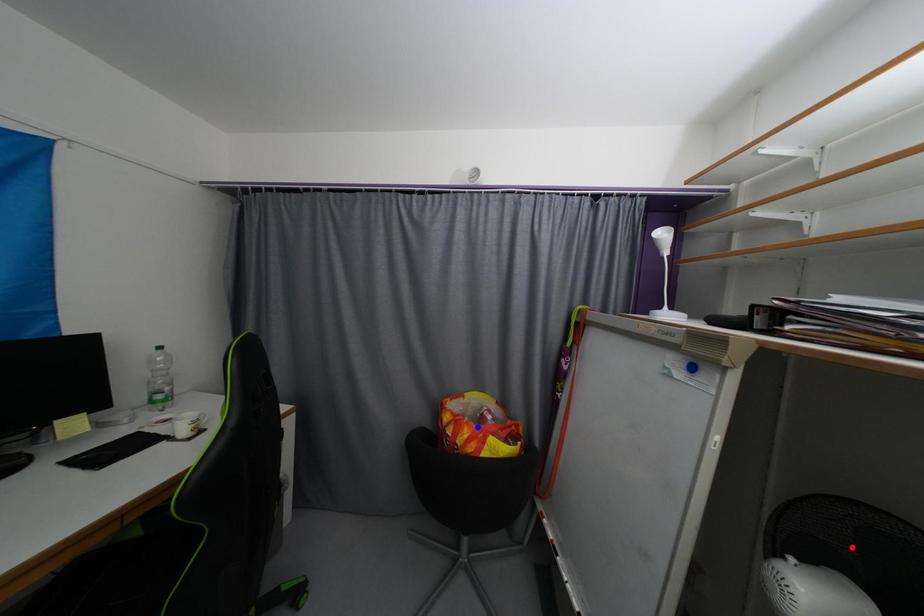
Question: In the image, two points are highlighted. Which point is nearer to the camera? Reply with the corresponding letter.

Choices:
 (A) blue point
 (B) red point

Answer: (B)